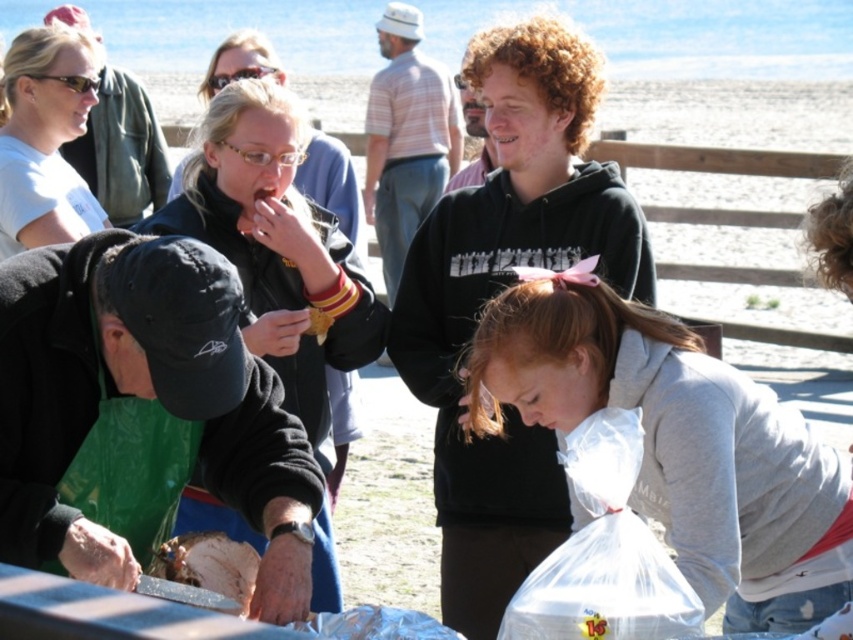
Question: Which of these objects is positioned farthest from the white matte t-shirt at upper left?

Choices:
 (A) gray matte plastic bag at lower center
 (B) black hoodie at upper center
 (C) shiny silver knife at lower left

Answer: (A)

Question: Is matte black jacket at center wider than shiny silver knife at lower left?

Choices:
 (A) no
 (B) yes

Answer: (B)

Question: Does white matte t-shirt at upper left appear under shiny silver knife at lower left?

Choices:
 (A) yes
 (B) no

Answer: (B)

Question: Which is nearer to the black hoodie at upper center?

Choices:
 (A) matte black jacket at center
 (B) gray matte plastic bag at lower center
 (C) white matte t-shirt at upper left

Answer: (A)

Question: Which point is farther to the camera?

Choices:
 (A) (190, 221)
 (B) (677, 564)

Answer: (A)

Question: Considering the relative positions of black hoodie at upper center and matte black jacket at center in the image provided, where is black hoodie at upper center located with respect to matte black jacket at center?

Choices:
 (A) right
 (B) left

Answer: (A)